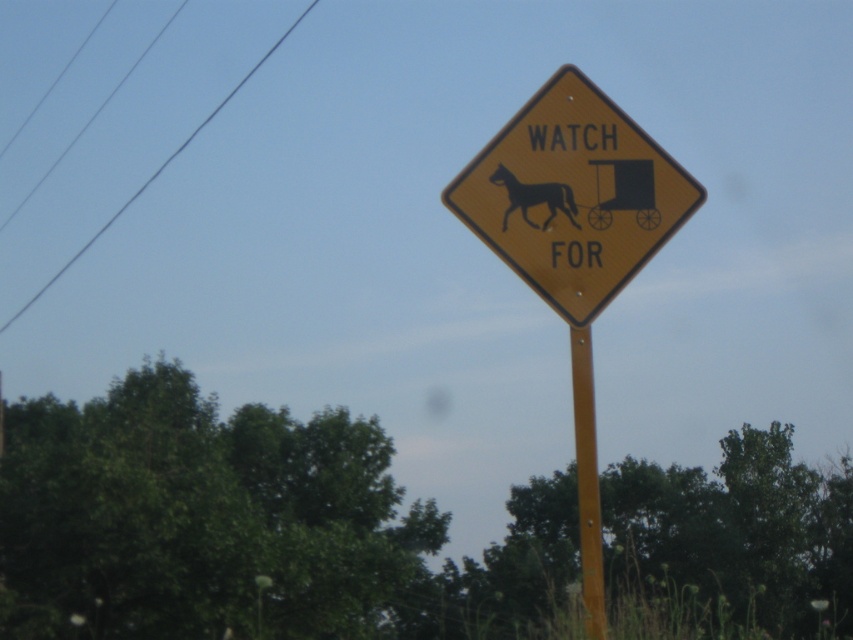
You are a driver approaching the yellow metallic pole at center with a black glossy horse at center on it. You need to park your car so that the pole is between your car and the horse. Where should you park relative to the pole?

The yellow metallic pole at center is positioned under the black glossy horse at center, so you should park your car behind the pole, ensuring the pole is between your car and the horse.

You are a driver approaching the road sign and notice the black wire at upper left and the black glossy horse at center. Which object appears taller in the image?

The black wire at upper left is much taller than the black glossy horse at center.